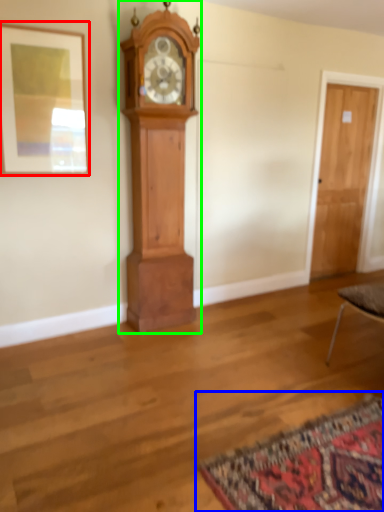
Question: Which object is positioned farthest from picture frame (highlighted by a red box)? Select from mat (highlighted by a blue box) and wall clock (highlighted by a green box).

Choices:
 (A) mat
 (B) wall clock

Answer: (A)